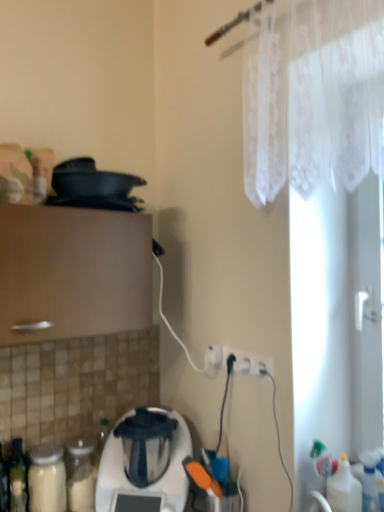
Question: From a real-world perspective, relative to white plastic electric outlet at lower center, is translucent plastic bottle at lower right vertically above or below?

Choices:
 (A) below
 (B) above

Answer: (A)

Question: Is translucent plastic bottle at lower right spatially inside white plastic electric outlet at lower center, or outside of it?

Choices:
 (A) outside
 (B) inside

Answer: (A)

Question: Which is farther from the white lace curtain at upper right?

Choices:
 (A) white plastic electric outlet at lower center
 (B) translucent plastic bottle at lower right
 (C) white plastic blender at lower center

Answer: (C)

Question: Which of these objects is positioned farthest from the translucent plastic bottle at lower right?

Choices:
 (A) white plastic electric outlet at lower center
 (B) white plastic blender at lower center
 (C) white lace curtain at upper right

Answer: (C)